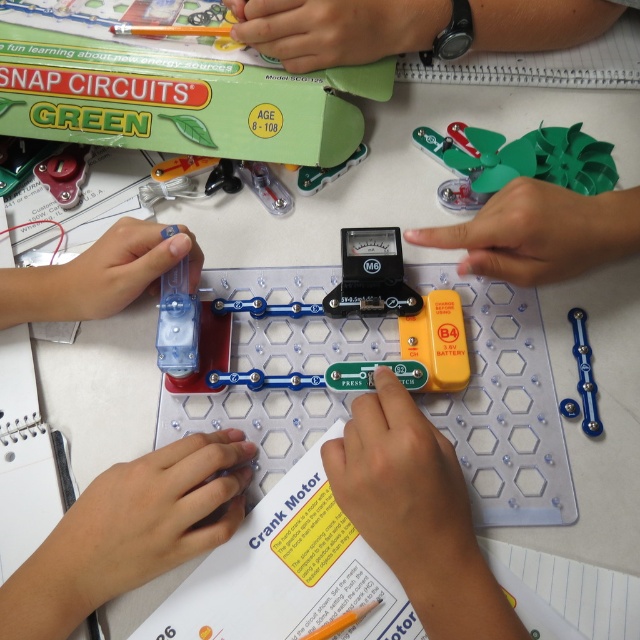
Looking at this image, does green plastic propeller at upper right appear on the right side of clear plastic screwdriver at center?

Correct, you'll find green plastic propeller at upper right to the right of clear plastic screwdriver at center.

Does green plastic propeller at upper right have a greater height compared to clear plastic screwdriver at center?

Indeed, green plastic propeller at upper right has a greater height compared to clear plastic screwdriver at center.

Identify the location of green plastic propeller at upper right. (516, 161).

Is green plastic propeller at upper right to the left of blue metallic gear at center from the viewer's perspective?

Indeed, green plastic propeller at upper right is positioned on the left side of blue metallic gear at center.

Which is behind, point (451, 128) or point (593, 429)?

The point (451, 128) is behind.

I want to click on green plastic propeller at upper right, so click(x=516, y=161).

Is transparent plastic crank motor at center wider than metallic red screw at upper left?

Yes, transparent plastic crank motor at center is wider than metallic red screw at upper left.

Is point (419, 323) in front of point (65, 161)?

Yes.

This screenshot has width=640, height=640. In order to click on transparent plastic crank motor at center in this screenshot , I will do `click(346, 316)`.